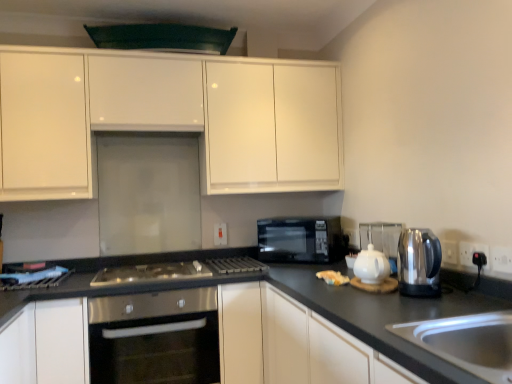
Question: Is black plastic electric outlet at right, which ranks as the 1th electric outlet in right-to-left order, thinner than white glossy teapot at center-right?

Choices:
 (A) yes
 (B) no

Answer: (A)

Question: Is the position of black plastic electric outlet at right, the 3th electric outlet from the back, less distant than that of white glossy teapot at center-right?

Choices:
 (A) yes
 (B) no

Answer: (A)

Question: Is black plastic electric outlet at right, which is the third electric outlet from left to right, at the right side of white glossy teapot at center-right?

Choices:
 (A) no
 (B) yes

Answer: (B)

Question: From the image's perspective, would you say black plastic electric outlet at right, marked as the 1th electric outlet in a front-to-back arrangement, is shown under white glossy teapot at center-right?

Choices:
 (A) yes
 (B) no

Answer: (B)

Question: From a real-world perspective, is black plastic electric outlet at right, the 3th electric outlet from the back, positioned over white glossy teapot at center-right based on gravity?

Choices:
 (A) no
 (B) yes

Answer: (B)

Question: Would you say black glass microwave at center is inside or outside white plastic electric outlet at center, the first electric outlet in the back-to-front sequence?

Choices:
 (A) outside
 (B) inside

Answer: (A)

Question: From a real-world perspective, is black glass microwave at center physically located above or below white plastic electric outlet at center, placed as the 3th electric outlet when sorted from right to left?

Choices:
 (A) below
 (B) above

Answer: (A)

Question: In the image, is black glass microwave at center positioned in front of or behind white plastic electric outlet at center, the 3th electric outlet when ordered from front to back?

Choices:
 (A) front
 (B) behind

Answer: (A)

Question: From the image's perspective, is black glass microwave at center above or below white plastic electric outlet at center, the 3th electric outlet when ordered from front to back?

Choices:
 (A) above
 (B) below

Answer: (B)

Question: From a real-world perspective, is black plastic electric outlet at lower right, the second electric outlet when ordered from front to back, above or below black glass microwave at center?

Choices:
 (A) below
 (B) above

Answer: (A)

Question: In the image, is black plastic electric outlet at lower right, placed as the 2th electric outlet when sorted from back to front, positioned in front of or behind black glass microwave at center?

Choices:
 (A) front
 (B) behind

Answer: (A)

Question: Looking at the image, does black plastic electric outlet at lower right, the second electric outlet when ordered from front to back, seem bigger or smaller compared to black glass microwave at center?

Choices:
 (A) big
 (B) small

Answer: (B)

Question: Considering the positions of point (480, 248) and point (275, 256), is point (480, 248) closer or farther from the camera than point (275, 256)?

Choices:
 (A) closer
 (B) farther

Answer: (A)

Question: Is black plastic electric outlet at right, marked as the 1th electric outlet in a front-to-back arrangement, bigger or smaller than black plastic electric outlet at lower right, the second electric outlet when ordered from front to back?

Choices:
 (A) big
 (B) small

Answer: (B)

Question: Is black plastic electric outlet at right, the 3th electric outlet from the back, spatially inside black plastic electric outlet at lower right, placed as the 2th electric outlet when sorted from back to front, or outside of it?

Choices:
 (A) outside
 (B) inside

Answer: (A)